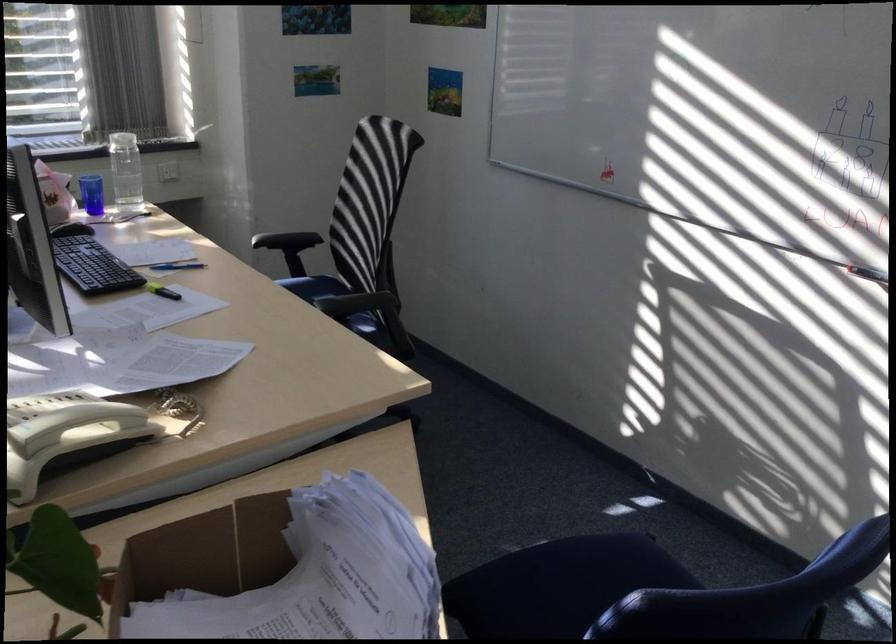
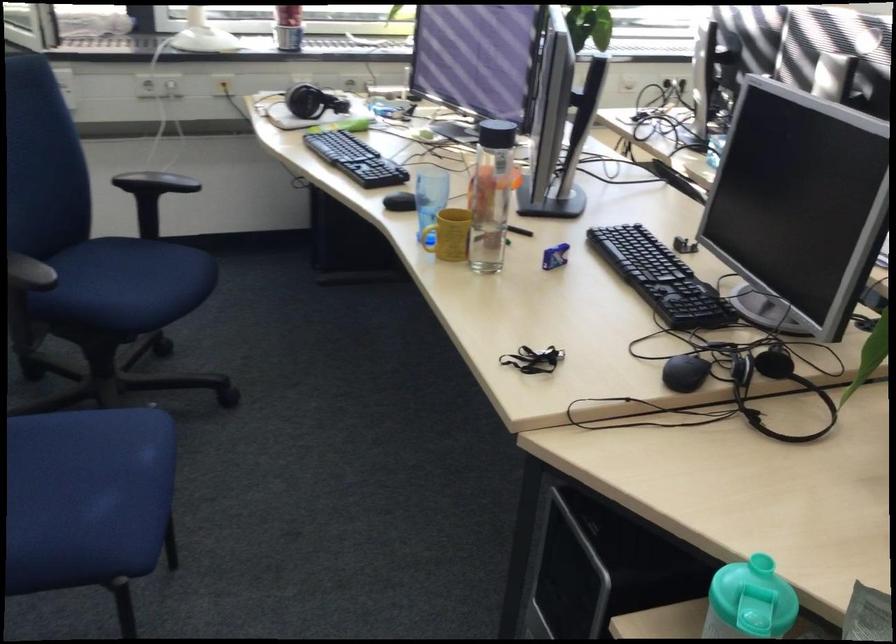
The images are taken continuously from a first-person perspective. In which direction are you moving?

The movement direction of the cameraman is left, backward.